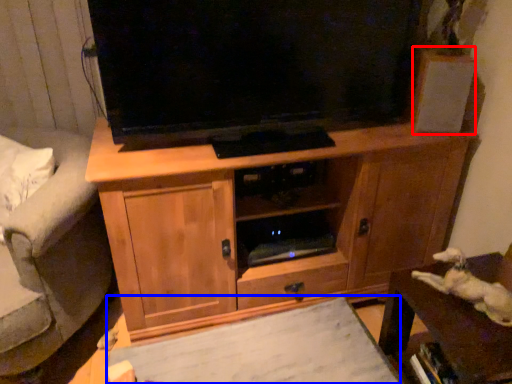
Question: Among these objects, which one is nearest to the camera, speaker (highlighted by a red box) or plain (highlighted by a blue box)?

Choices:
 (A) speaker
 (B) plain

Answer: (B)